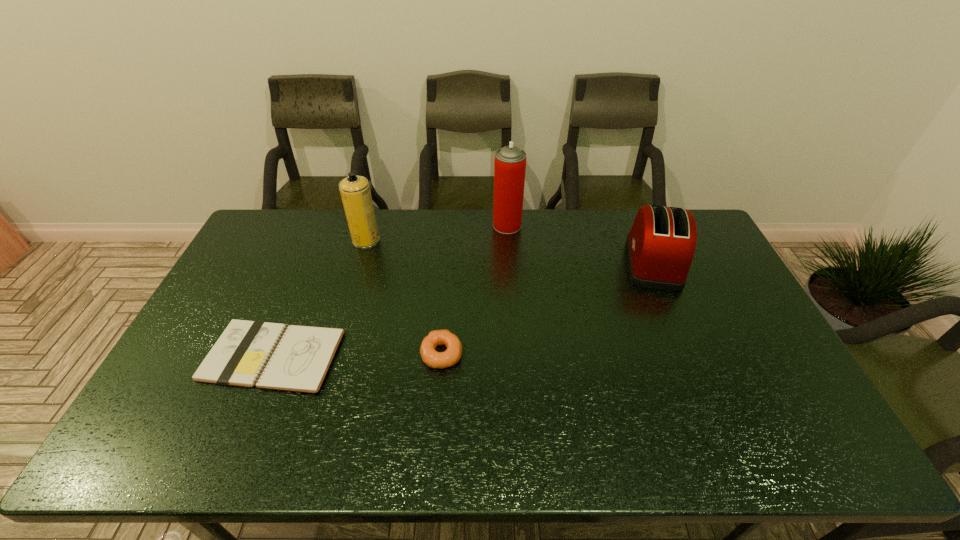
Find the location of `free space at the left edge`. free space at the left edge is located at coordinates (244, 284).

The width and height of the screenshot is (960, 540). In order to click on vacant area at the right edge in this screenshot , I will do `click(718, 287)`.

Locate an element on the screen. The width and height of the screenshot is (960, 540). vacant space at the far left corner is located at coordinates (282, 213).

Find the location of `vacant space at the near left corner of the desktop`. vacant space at the near left corner of the desktop is located at coordinates (149, 443).

Locate an element on the screen. The image size is (960, 540). free spot at the far right corner of the desktop is located at coordinates (701, 228).

The width and height of the screenshot is (960, 540). Find the location of `unoccupied position between the third object from right to left and the notepad`. unoccupied position between the third object from right to left and the notepad is located at coordinates (357, 355).

I want to click on vacant space that is in between the shorter aerosol can and the third object from right to left, so click(x=404, y=297).

This screenshot has height=540, width=960. Find the location of `vacant area that lies between the shortest object and the fourth shortest object`. vacant area that lies between the shortest object and the fourth shortest object is located at coordinates (320, 298).

Find the location of `free area in between the second shortest object and the third tallest object`. free area in between the second shortest object and the third tallest object is located at coordinates (547, 308).

At what (x,y) coordinates should I click in order to perform the action: click on free point between the shortest object and the left aerosol can. Please return your answer as a coordinate pair (x, y). The height and width of the screenshot is (540, 960). Looking at the image, I should click on (320, 298).